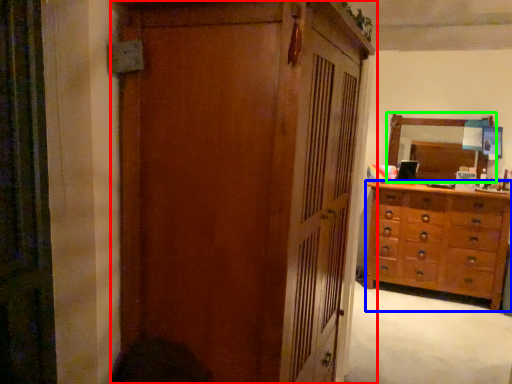
Question: Estimate the real-world distances between objects in this image. Which object is closer to cupboard (highlighted by a red box), chest of drawers (highlighted by a blue box) or mirror (highlighted by a green box)?

Choices:
 (A) chest of drawers
 (B) mirror

Answer: (A)